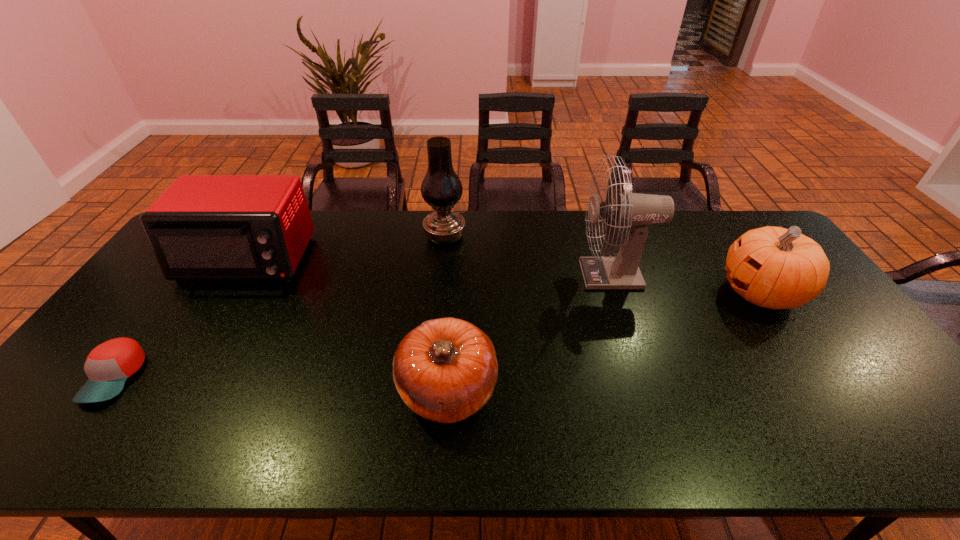
This screenshot has width=960, height=540. Find the location of `the fifth object from left to right`. the fifth object from left to right is located at coordinates (637, 211).

This screenshot has width=960, height=540. In order to click on oil lamp in this screenshot , I will do `click(441, 188)`.

Locate an element on the screen. This screenshot has width=960, height=540. toaster oven is located at coordinates (203, 227).

Locate an element on the screen. The image size is (960, 540). the taller pumpkin is located at coordinates (773, 267).

Identify the location of the farther pumpkin. The image size is (960, 540). (773, 267).

The image size is (960, 540). I want to click on the shorter pumpkin, so click(445, 370).

Identify the location of the fifth tallest object. This screenshot has width=960, height=540. (445, 370).

This screenshot has width=960, height=540. Identify the location of baseball cap. (108, 366).

Locate an element on the screen. This screenshot has width=960, height=540. free spot located 0.400m on the air flow direction of the fan is located at coordinates (452, 274).

Where is `vacant space positioned 0.110m on the air flow direction of the fan`? vacant space positioned 0.110m on the air flow direction of the fan is located at coordinates (544, 274).